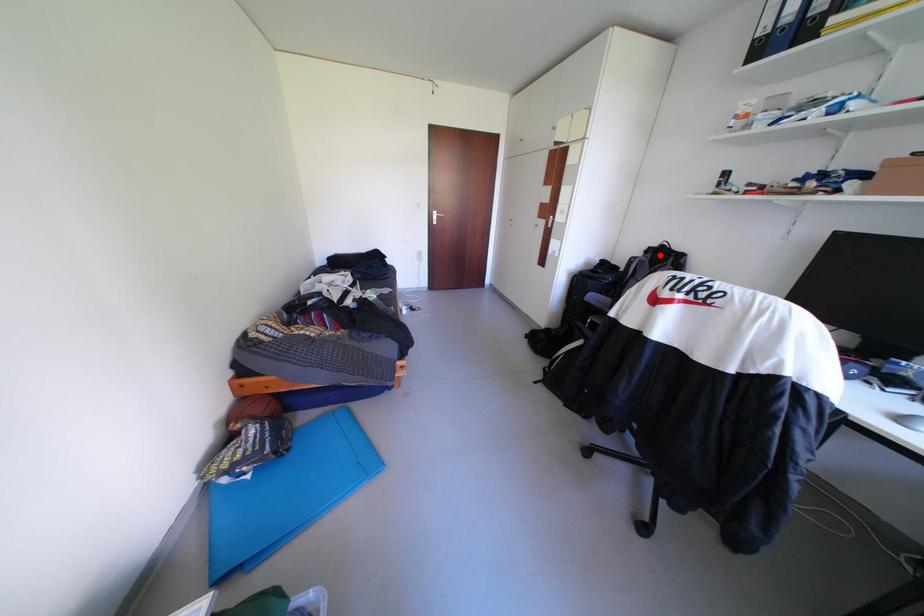
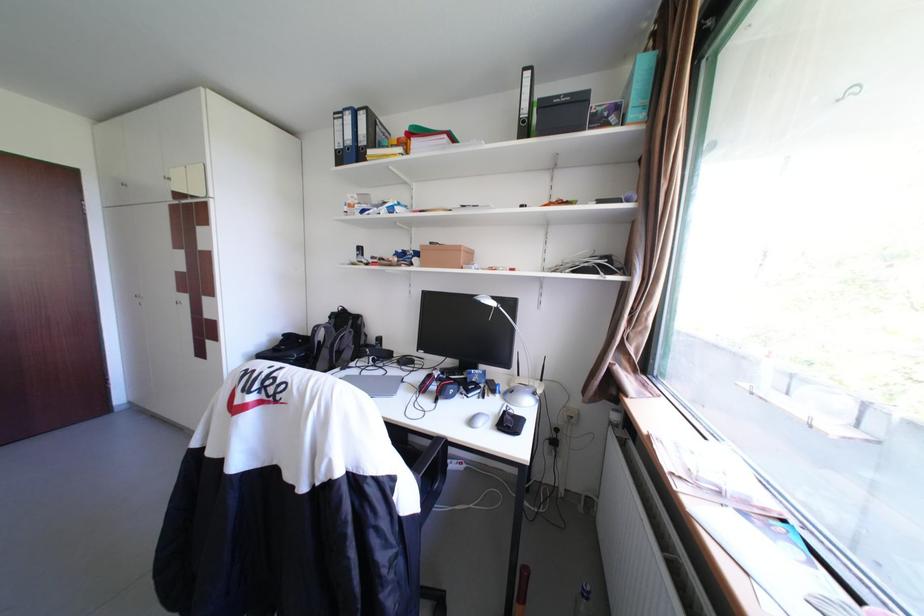
In the second image, find the point that corresponds to the highlighted location in the first image.

(344, 321)